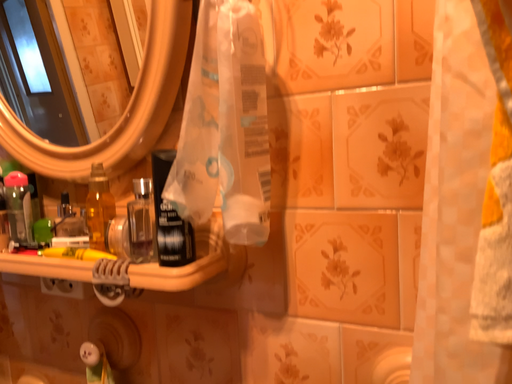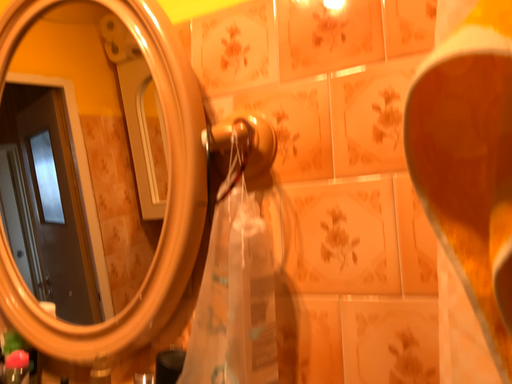
Question: How did the camera likely rotate when shooting the video?

Choices:
 (A) rotated upward
 (B) rotated downward

Answer: (A)